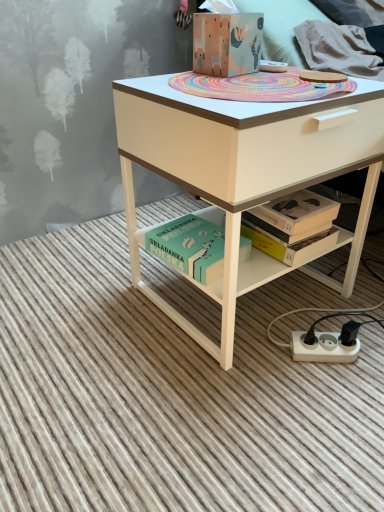
Identify the location of vacant area that is in front of white plastic power plugs and sockets at lower right. (327, 407).